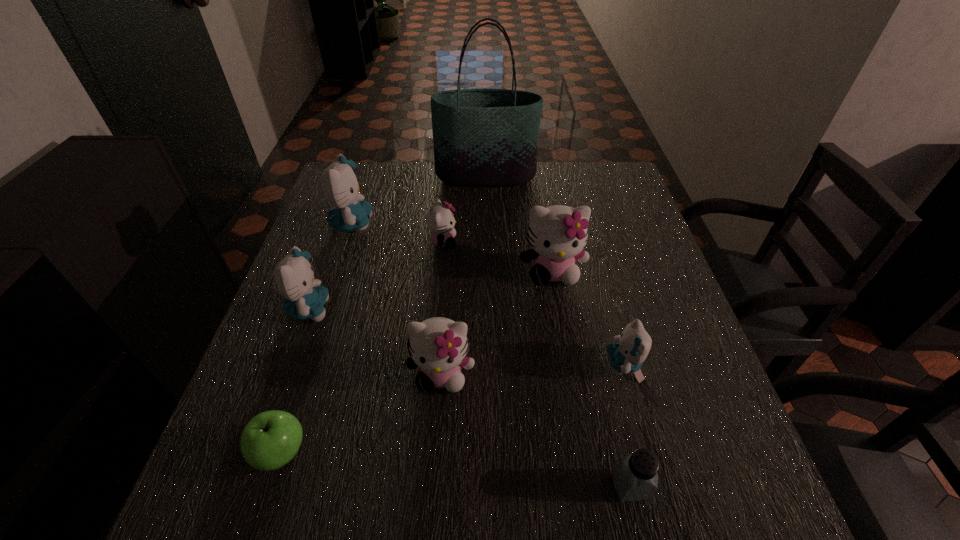
This screenshot has width=960, height=540. Find the location of `vacant space at the near edge of the desktop`. vacant space at the near edge of the desktop is located at coordinates (501, 488).

I want to click on free space at the left edge, so click(280, 364).

This screenshot has width=960, height=540. In order to click on vacant region at the right edge in this screenshot , I will do `click(642, 276)`.

Identify the location of vacant space at the far left corner of the desktop. This screenshot has height=540, width=960. (380, 173).

I want to click on vacant space in between the farthest white kitten and the nearest white kitten, so click(443, 308).

The width and height of the screenshot is (960, 540). What are the coordinates of `vacant space that's between the smallest white kitten and the second nearest white kitten` in the screenshot? It's located at (497, 256).

The height and width of the screenshot is (540, 960). Identify the location of unoccupied position between the apple and the smallest white kitten. (362, 347).

Locate an element on the screen. The image size is (960, 540). unoccupied position between the green apple and the tote bag is located at coordinates (384, 314).

What are the coordinates of `vacant point located between the rightmost blue kitten and the second biggest white kitten` in the screenshot? It's located at (533, 370).

Identify the location of vacant space that's between the apple and the nearest white kitten. (362, 414).